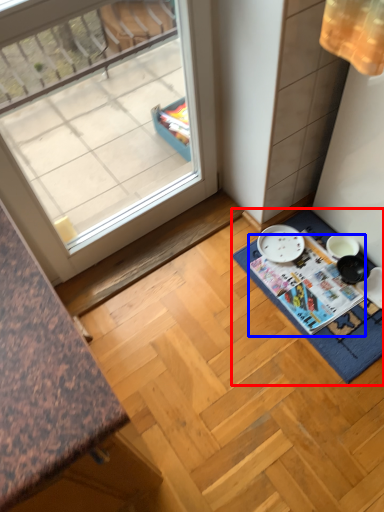
Question: Which of the following is the closest to the observer, bath mat (highlighted by a red box) or magazine (highlighted by a blue box)?

Choices:
 (A) bath mat
 (B) magazine

Answer: (A)